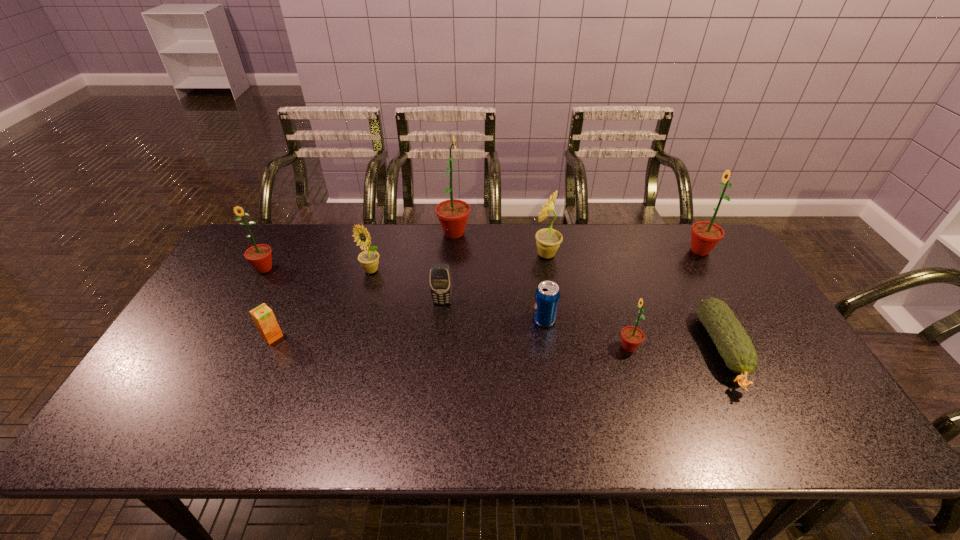
Locate which object ranks fourth in proximity to the biggest green sunflower. Please provide its 2D coordinates. Your answer should be formatted as a tuple, i.e. [(x, y)], where the tuple contains the x and y coordinates of a point satisfying the conditions above.

[(547, 295)]

Choose which object is the third nearest neighbor to the second object from left to right. Please provide its 2D coordinates. Your answer should be formatted as a tuple, i.e. [(x, y)], where the tuple contains the x and y coordinates of a point satisfying the conditions above.

[(439, 274)]

Select which sunflower is the closest to the blue pop soda. Please provide its 2D coordinates. Your answer should be formatted as a tuple, i.e. [(x, y)], where the tuple contains the x and y coordinates of a point satisfying the conditions above.

[(632, 337)]

You are a GUI agent. You are given a task and a screenshot of the screen. Output one action in this format:
    pyautogui.click(x=<x>, y=<y>)
    Task: Click on the sunflower that is the fifth closest one to the third sunflower from right to left
    The width and height of the screenshot is (960, 540).
    Given the screenshot: What is the action you would take?
    pyautogui.click(x=259, y=256)

The image size is (960, 540). Find the location of `the second closest green sunflower to the fifth nearest object`. the second closest green sunflower to the fifth nearest object is located at coordinates (632, 337).

This screenshot has width=960, height=540. Identify the location of green sunflower identified as the closest to the smaller yellow sunflower. (453, 214).

Identify the location of free spot that satisfies the following two spatial constraints: 1. on the face of the bigger yellow sunflower; 2. on the face of the eighth object from right to left. The width and height of the screenshot is (960, 540). (549, 271).

This screenshot has height=540, width=960. In order to click on vacant space that satisfies the following two spatial constraints: 1. on the face of the pop soda; 2. on the right side of the left yellow sunflower in this screenshot , I will do `click(357, 320)`.

In order to click on free region that satisfies the following two spatial constraints: 1. on the face of the rightmost object; 2. on the face of the smaller yellow sunflower in this screenshot , I will do `click(711, 271)`.

Identify the location of vacant space that satisfies the following two spatial constraints: 1. on the face of the third sunflower from right to left; 2. on the front face of the sixth farthest object. (x=555, y=302).